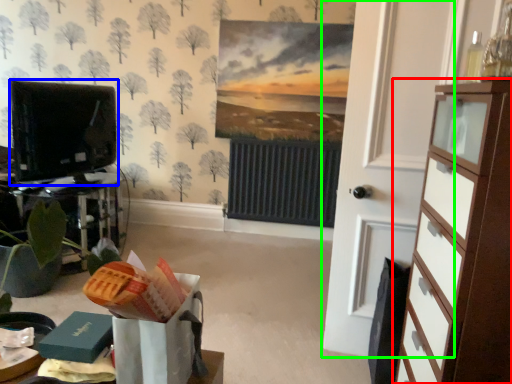
Question: Which object is positioned farthest from chest of drawers (highlighted by a red box)? Select from electronic (highlighted by a blue box) and door (highlighted by a green box).

Choices:
 (A) electronic
 (B) door

Answer: (A)